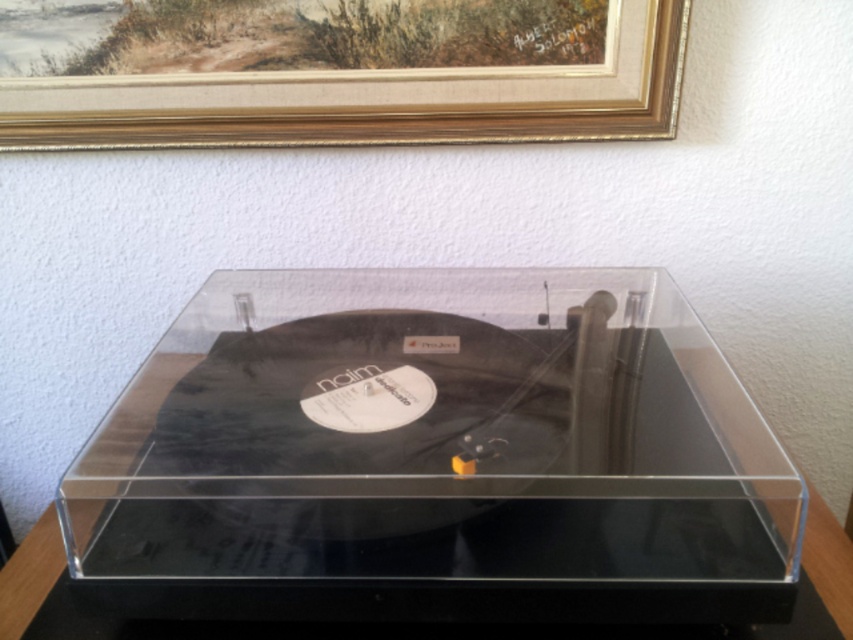
You are setting up a display in a small room and need to arrange the transparent acrylic record player at center and the gold wood picture frame at upper center. Given their thickness, which object should be placed closer to the wall to save space?

The transparent acrylic record player at center is thinner than the gold wood picture frame at upper center, so placing the transparent acrylic record player at center closer to the wall would save space as it takes up less depth.

You are standing in front of a wall with a record player and a framed painting. You need to place a new decorative item exactly at the point marked as point (436, 456). What object is currently located at that point?

The transparent acrylic record player at center is located at point (436, 456).